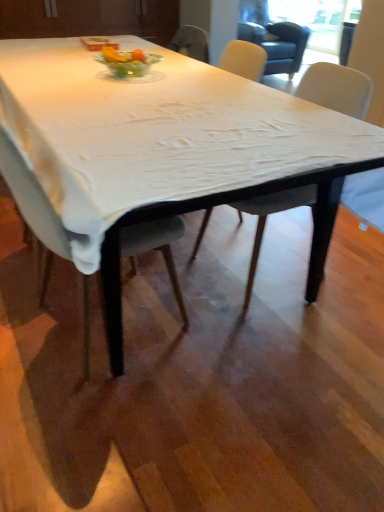
What is the approximate height of white fabric chair at center, positioned as the 2th chair in left-to-right order?

35.27 inches.

I want to click on white cloth-covered table at center, so click(167, 149).

From a real-world perspective, relative to white cloth-covered table at center, is white fabric chair at center, positioned as the 2th chair in left-to-right order, vertically above or below?

white fabric chair at center, positioned as the 2th chair in left-to-right order, is below white cloth-covered table at center.

How many degrees apart are the facing directions of white fabric chair at center, positioned as the 2th chair in left-to-right order, and white cloth-covered table at center?

The facing directions of white fabric chair at center, positioned as the 2th chair in left-to-right order, and white cloth-covered table at center are 179 degrees apart.

Is white fabric chair at center, positioned as the 2th chair in left-to-right order, positioned beyond the bounds of white cloth-covered table at center?

That's incorrect, white fabric chair at center, positioned as the 2th chair in left-to-right order, is not completely outside white cloth-covered table at center.

Is white fabric chair at center, positioned as the 2th chair in left-to-right order, thinner than white cloth-covered table at center?

Yes, white fabric chair at center, positioned as the 2th chair in left-to-right order, is thinner than white cloth-covered table at center.

Which object is thinner, transparent glass window screen at upper right or white fabric chair at center, positioned as the 2th chair in left-to-right order?

Thinner between the two is transparent glass window screen at upper right.

From a real-world perspective, is transparent glass window screen at upper right positioned above or below white fabric chair at center, which is the first chair from right to left?

transparent glass window screen at upper right is below white fabric chair at center, which is the first chair from right to left.

From the image's perspective, does transparent glass window screen at upper right appear lower than white fabric chair at center, which is the first chair from right to left?

No, from the image's perspective, transparent glass window screen at upper right is not below white fabric chair at center, which is the first chair from right to left.

The height and width of the screenshot is (512, 384). In the image, there is a white fabric chair at center, positioned as the 2th chair in left-to-right order. In order to click on window screen below it (from a real-world perspective) in this screenshot , I will do `click(318, 19)`.

What's the angular difference between transparent glass window screen at upper right and clear glass bowl at center's facing directions?

There is a 87.2-degree angle between the facing directions of transparent glass window screen at upper right and clear glass bowl at center.

In the scene shown: Could you tell me if transparent glass window screen at upper right is facing clear glass bowl at center?

No, transparent glass window screen at upper right is not oriented towards clear glass bowl at center.

Is transparent glass window screen at upper right to the right of clear glass bowl at center from the viewer's perspective?

Yes, transparent glass window screen at upper right is to the right of clear glass bowl at center.

Identify the location of window screen above the clear glass bowl at center (from the image's perspective). The image size is (384, 512). (318, 19).

Is matte gray chair at center, marked as the 1th chair in a left-to-right arrangement, a part of white cloth-covered table at center?

No, matte gray chair at center, marked as the 1th chair in a left-to-right arrangement, is located outside of white cloth-covered table at center.

Does point (71, 102) appear closer or farther from the camera than point (153, 247)?

Point (71, 102) is farther from the camera than point (153, 247).

Is white cloth-covered table at center not close to matte gray chair at center, marked as the 1th chair in a left-to-right arrangement?

No, white cloth-covered table at center is not far away from matte gray chair at center, marked as the 1th chair in a left-to-right arrangement.

Does white cloth-covered table at center come behind matte gray chair at center, which is the 2th chair in right-to-left order?

No.

Who is shorter, white fabric chair at center, positioned as the 2th chair in left-to-right order, or matte gray chair at center, which is the 2th chair in right-to-left order?

matte gray chair at center, which is the 2th chair in right-to-left order.

Considering the relative positions of white fabric chair at center, which is the first chair from right to left, and matte gray chair at center, marked as the 1th chair in a left-to-right arrangement, in the image provided, is white fabric chair at center, which is the first chair from right to left, to the right of matte gray chair at center, marked as the 1th chair in a left-to-right arrangement, from the viewer's perspective?

Correct, you'll find white fabric chair at center, which is the first chair from right to left, to the right of matte gray chair at center, marked as the 1th chair in a left-to-right arrangement.

Consider the image. Is white fabric chair at center, which is the first chair from right to left, closer to the viewer compared to matte gray chair at center, marked as the 1th chair in a left-to-right arrangement?

No, white fabric chair at center, which is the first chair from right to left, is behind matte gray chair at center, marked as the 1th chair in a left-to-right arrangement.

Considering the positions of point (54, 250) and point (351, 88), is point (54, 250) closer or farther from the camera than point (351, 88)?

Point (54, 250) appears to be closer to the viewer than point (351, 88).

Is there a large distance between matte gray chair at center, marked as the 1th chair in a left-to-right arrangement, and white fabric chair at center, which is the first chair from right to left?

Yes.

From a real-world perspective, who is located higher, matte gray chair at center, which is the 2th chair in right-to-left order, or white fabric chair at center, which is the first chair from right to left?

From a 3D spatial view, matte gray chair at center, which is the 2th chair in right-to-left order, is above.

Does matte gray chair at center, which is the 2th chair in right-to-left order, have a larger size compared to white fabric chair at center, which is the first chair from right to left?

Actually, matte gray chair at center, which is the 2th chair in right-to-left order, might be smaller than white fabric chair at center, which is the first chair from right to left.

Is matte gray chair at center, marked as the 1th chair in a left-to-right arrangement, smaller than transparent glass window screen at upper right?

No.

What's the angular difference between matte gray chair at center, marked as the 1th chair in a left-to-right arrangement, and transparent glass window screen at upper right's facing directions?

173 degrees separate the facing orientations of matte gray chair at center, marked as the 1th chair in a left-to-right arrangement, and transparent glass window screen at upper right.

Looking at their sizes, would you say matte gray chair at center, which is the 2th chair in right-to-left order, is wider or thinner than transparent glass window screen at upper right?

Clearly, matte gray chair at center, which is the 2th chair in right-to-left order, has more width compared to transparent glass window screen at upper right.

Which is behind, point (12, 142) or point (313, 20)?

Point (313, 20)

Identify the location of the 2nd chair positioned below the white cloth-covered table at center (from a real-world perspective). The width and height of the screenshot is (384, 512). (337, 89).

This screenshot has width=384, height=512. Identify the location of the 1st chair in front of the transparent glass window screen at upper right, starting your count from the anchor. (337, 89).

Estimate the real-world distances between objects in this image. Which object is closer to white cloth-covered table at center, clear glass bowl at center or matte gray chair at center, which is the 2th chair in right-to-left order?

The object closer to white cloth-covered table at center is matte gray chair at center, which is the 2th chair in right-to-left order.

Based on the photo, looking at the image, which one is located further to transparent glass window screen at upper right, clear glass bowl at center or white cloth-covered table at center?

white cloth-covered table at center is positioned further to the anchor transparent glass window screen at upper right.

Considering their positions, is clear glass bowl at center positioned closer to white fabric chair at center, which is the first chair from right to left, than white cloth-covered table at center?

The object closer to white fabric chair at center, which is the first chair from right to left, is white cloth-covered table at center.

Looking at the image, which one is located further to transparent glass window screen at upper right, clear glass bowl at center or white fabric chair at center, positioned as the 2th chair in left-to-right order?

white fabric chair at center, positioned as the 2th chair in left-to-right order.

Based on their spatial positions, is matte gray chair at center, which is the 2th chair in right-to-left order, or clear glass bowl at center further from transparent glass window screen at upper right?

matte gray chair at center, which is the 2th chair in right-to-left order, is further to transparent glass window screen at upper right.

Which object lies nearer to the anchor point clear glass bowl at center, matte gray chair at center, marked as the 1th chair in a left-to-right arrangement, or white fabric chair at center, which is the first chair from right to left?

white fabric chair at center, which is the first chair from right to left.

From the image, which object appears to be farther from white cloth-covered table at center, matte gray chair at center, which is the 2th chair in right-to-left order, or transparent glass window screen at upper right?

The object further to white cloth-covered table at center is transparent glass window screen at upper right.

Looking at the image, which one is located further to clear glass bowl at center, white cloth-covered table at center or white fabric chair at center, which is the first chair from right to left?

white fabric chair at center, which is the first chair from right to left, lies further to clear glass bowl at center than the other object.

The width and height of the screenshot is (384, 512). I want to click on glass bowl located between white cloth-covered table at center and transparent glass window screen at upper right in the depth direction, so click(x=128, y=62).

Locate an element on the screen. glass bowl between matte gray chair at center, marked as the 1th chair in a left-to-right arrangement, and transparent glass window screen at upper right, along the z-axis is located at coordinates (128, 62).

The width and height of the screenshot is (384, 512). I want to click on chair between matte gray chair at center, which is the 2th chair in right-to-left order, and clear glass bowl at center from front to back, so click(337, 89).

The width and height of the screenshot is (384, 512). What are the coordinates of `chair between matte gray chair at center, marked as the 1th chair in a left-to-right arrangement, and transparent glass window screen at upper right, along the z-axis` in the screenshot? It's located at (337, 89).